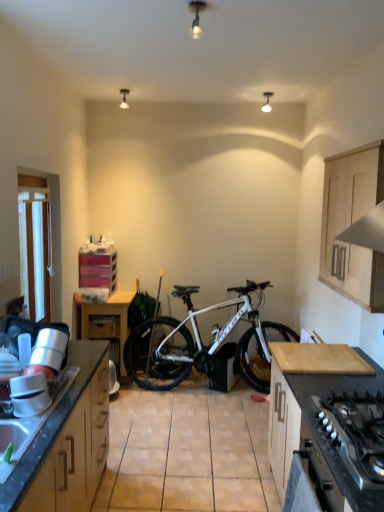
Question: From a real-world perspective, relative to pink plastic drawers at center left, which is the 4th cabinetry in front-to-back order, is white fabric at left vertically above or below?

Choices:
 (A) above
 (B) below

Answer: (A)

Question: In the image, is white fabric at left on the left side or the right side of pink plastic drawers at center left, marked as the 4th cabinetry in a right-to-left arrangement?

Choices:
 (A) right
 (B) left

Answer: (B)

Question: Based on their relative distances, which object is farther from the matte plastic drawer at center?

Choices:
 (A) wooden table at center
 (B) pink plastic drawers at center left, the 1th cabinetry viewed from the left
 (C) light wood cabinet at upper right, which is the first cabinetry from right to left
 (D) wooden cabinet at left, the 2th cabinetry positioned from the left
 (E) granite gray sink at lower left

Answer: (C)

Question: Estimate the real-world distances between objects in this image. Which object is farther from the black matte gas stove at lower right?

Choices:
 (A) wooden table at center
 (B) white fabric at left
 (C) pink plastic drawers at center left, the 1th cabinetry viewed from the left
 (D) white matte bicycle at center
 (E) wooden cabinet at left, the 4th cabinetry positioned from the back

Answer: (C)